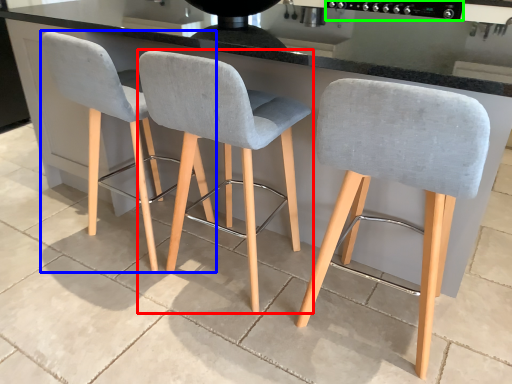
Question: Which object is positioned farthest from chair (highlighted by a red box)? Select from chair (highlighted by a blue box) and appliance (highlighted by a green box).

Choices:
 (A) chair
 (B) appliance

Answer: (B)